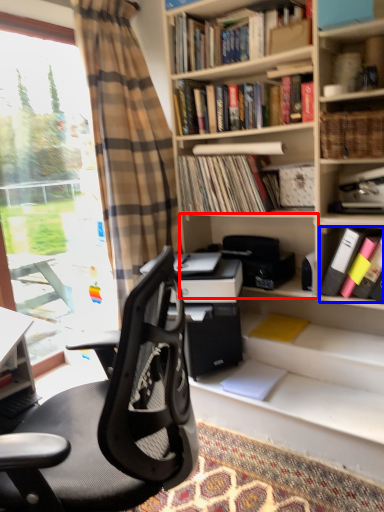
Question: Which object is closer to the camera taking this photo, shelf (highlighted by a red box) or book (highlighted by a blue box)?

Choices:
 (A) shelf
 (B) book

Answer: (B)